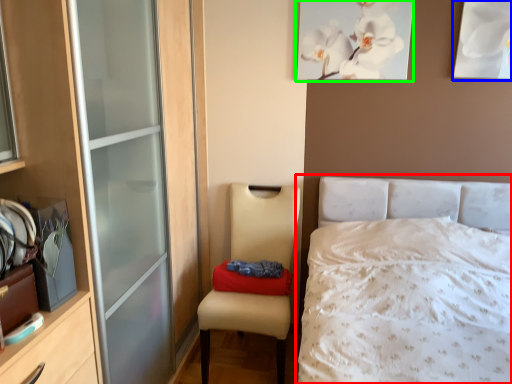
Question: Estimate the real-world distances between objects in this image. Which object is closer to bed (highlighted by a red box), picture frame (highlighted by a blue box) or picture frame (highlighted by a green box)?

Choices:
 (A) picture frame
 (B) picture frame

Answer: (B)